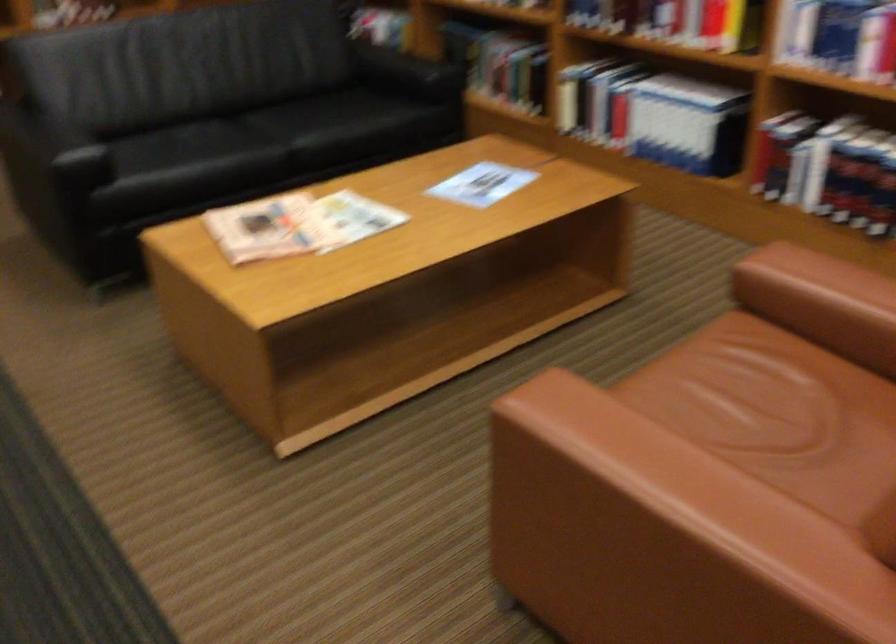
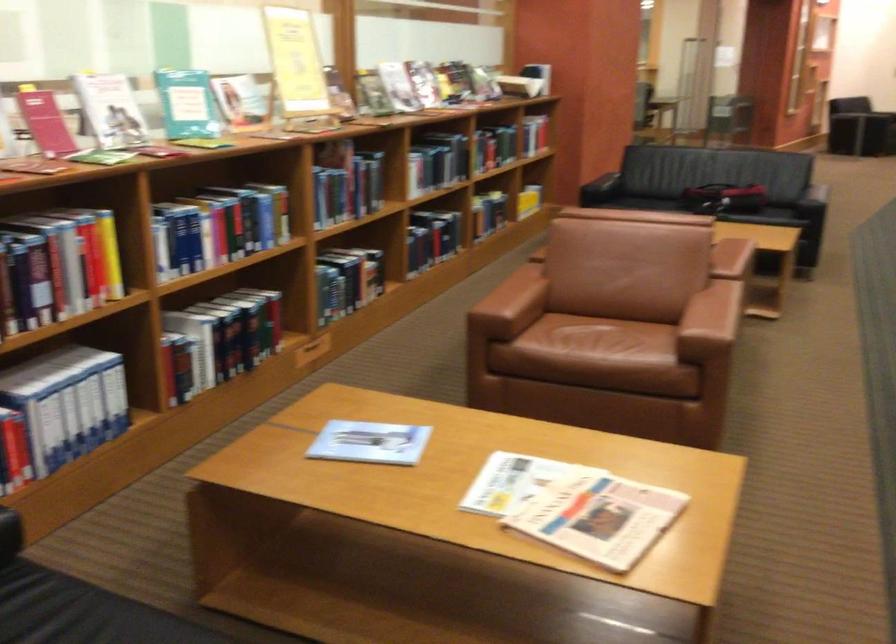
Locate, in the second image, the point that corresponds to the point at 479,199 in the first image.

(369, 442)